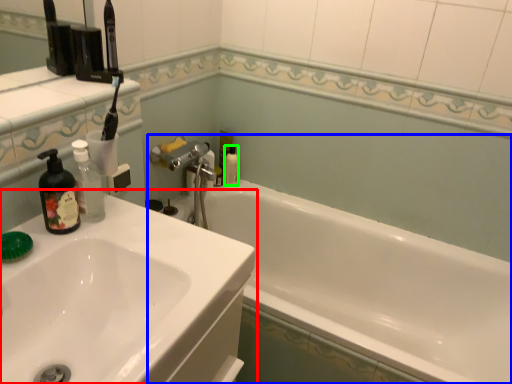
Question: Which object is the farthest from sink (highlighted by a red box)? Choose among these: bathtub (highlighted by a blue box) or mouthwash (highlighted by a green box).

Choices:
 (A) bathtub
 (B) mouthwash

Answer: (B)